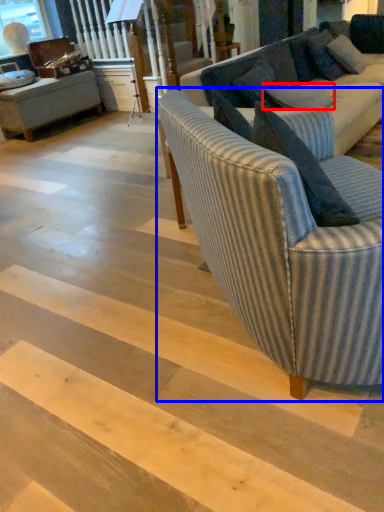
Question: Which object is closer to the camera taking this photo, pillow (highlighted by a red box) or studio couch (highlighted by a blue box)?

Choices:
 (A) pillow
 (B) studio couch

Answer: (B)